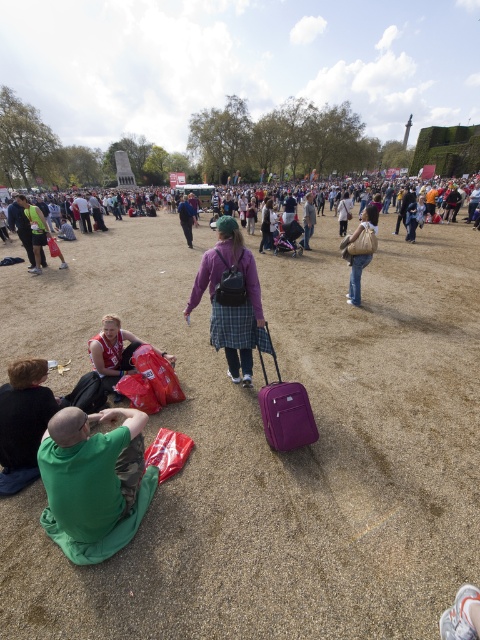
Consider the image. Is green matte shirt at lower left smaller than plaid skirt at center?

Correct, green matte shirt at lower left occupies less space than plaid skirt at center.

Does green matte shirt at lower left appear over plaid skirt at center?

No.

Is point (85, 429) in front of point (231, 330)?

Yes, point (85, 429) is in front of point (231, 330).

Where is `green matte shirt at lower left`? This screenshot has width=480, height=640. green matte shirt at lower left is located at coordinates (84, 468).

Between purple matte suitcase at center and matte red backpack at lower left, which one appears on the left side from the viewer's perspective?

matte red backpack at lower left is more to the left.

Who is more distant from viewer, (x=286, y=424) or (x=105, y=362)?

The point (x=105, y=362) is more distant.

The height and width of the screenshot is (640, 480). I want to click on purple matte suitcase at center, so 285,410.

Can you confirm if green matte shirt at lower left is bigger than beige fabric bag at center?

No, green matte shirt at lower left is not bigger than beige fabric bag at center.

Who is taller, green matte shirt at lower left or beige fabric bag at center?

Standing taller between the two is beige fabric bag at center.

Which is in front, point (98, 436) or point (367, 252)?

Positioned in front is point (98, 436).

Find the location of a particular element. green matte shirt at lower left is located at coordinates (84, 468).